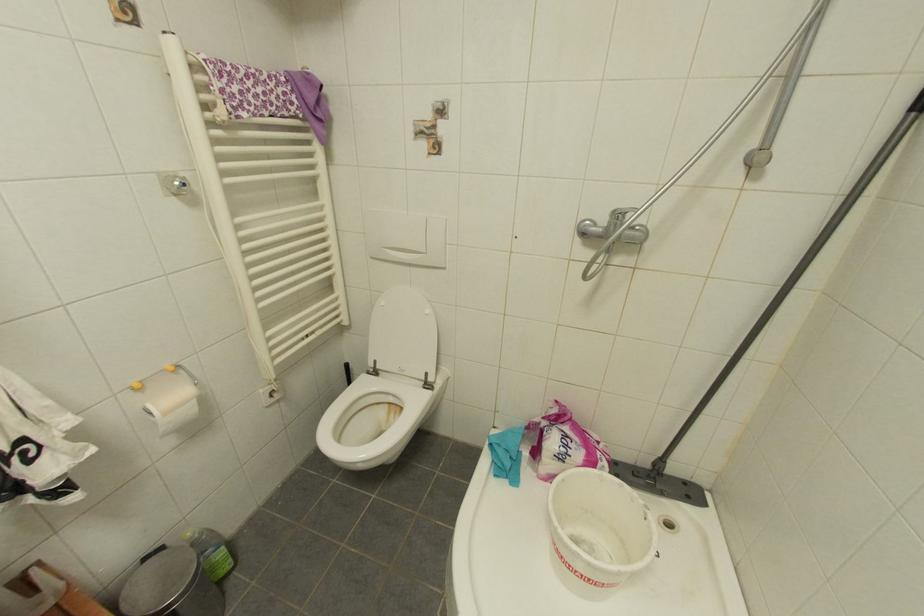
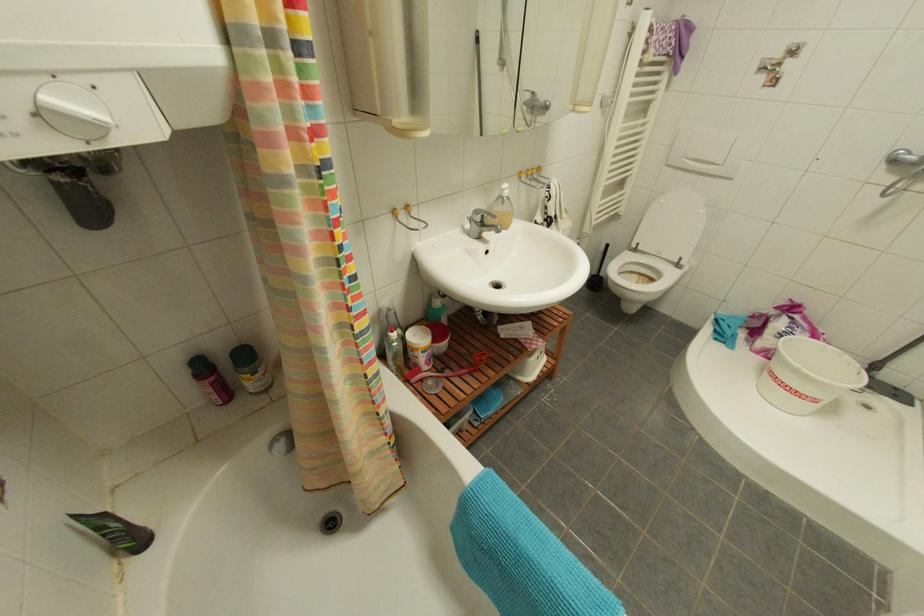
In a continuous first-person perspective shot, in which direction is the camera moving?

The cameraman moved toward left, backward.